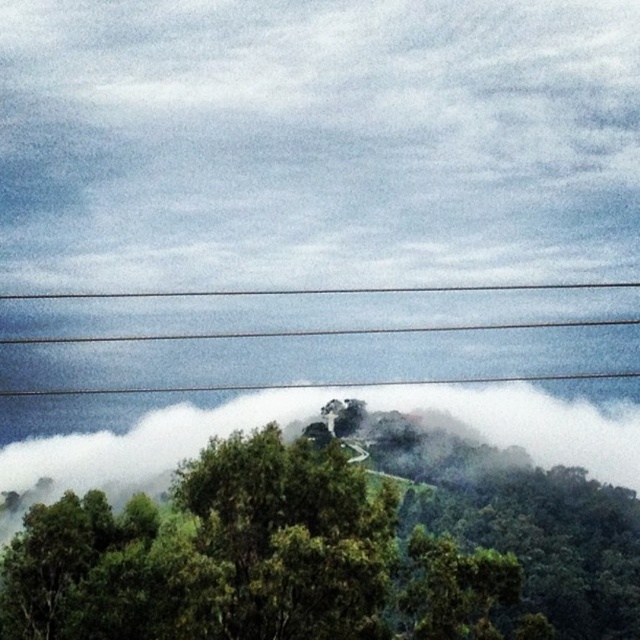
Question: Can you confirm if green leafy tree at center is positioned to the left of smooth wire at upper center?

Choices:
 (A) yes
 (B) no

Answer: (B)

Question: Does green leafy tree at center appear on the left side of smooth wire at upper center?

Choices:
 (A) no
 (B) yes

Answer: (A)

Question: Which object appears farthest from the camera in this image?

Choices:
 (A) smooth wire at upper center
 (B) green leafy tree at center

Answer: (A)

Question: Can you confirm if green leafy tree at center is bigger than smooth wire at upper center?

Choices:
 (A) yes
 (B) no

Answer: (A)

Question: Which point is farther to the camera?

Choices:
 (A) (320, 492)
 (B) (182, 296)

Answer: (B)